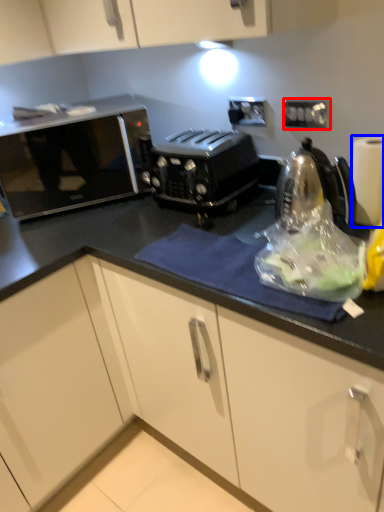
Question: Which of the following is the farthest to the observer, electric outlet (highlighted by a red box) or paper towel (highlighted by a blue box)?

Choices:
 (A) electric outlet
 (B) paper towel

Answer: (A)